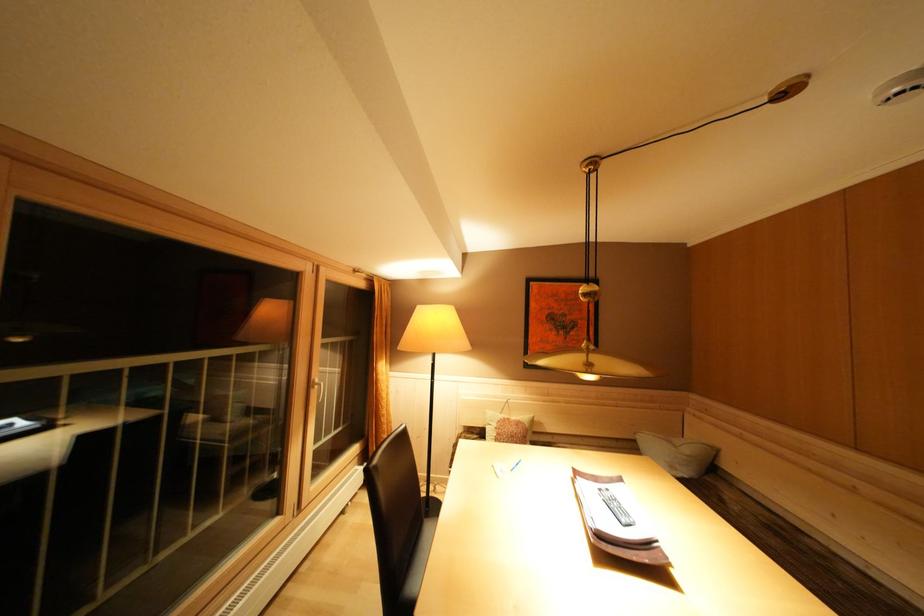
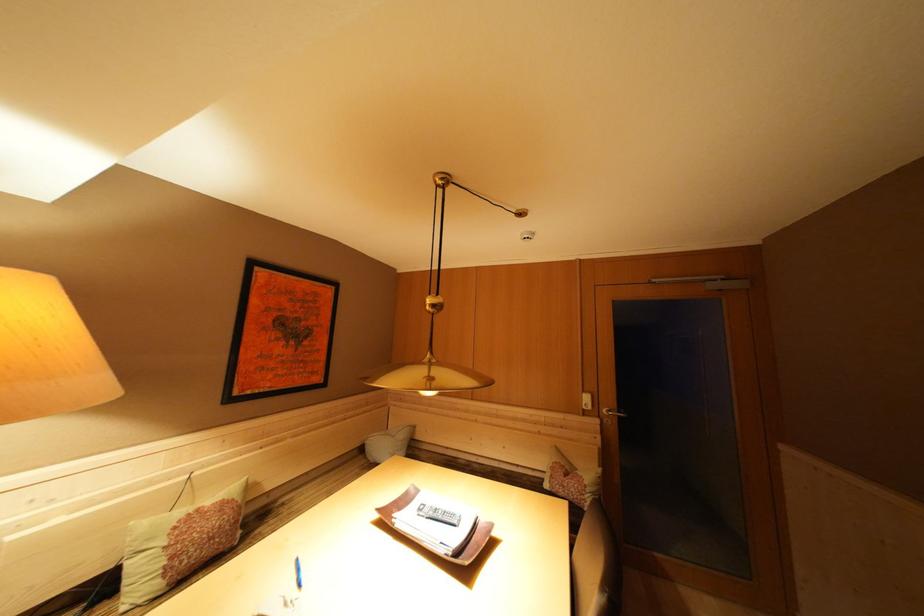
Where in the second image is the point corresponding to the point at 515,424 from the first image?

(204, 515)